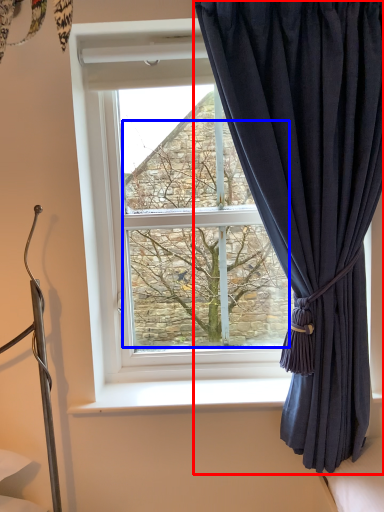
Question: Which object is further to the camera taking this photo, curtain (highlighted by a red box) or tree (highlighted by a blue box)?

Choices:
 (A) curtain
 (B) tree

Answer: (B)